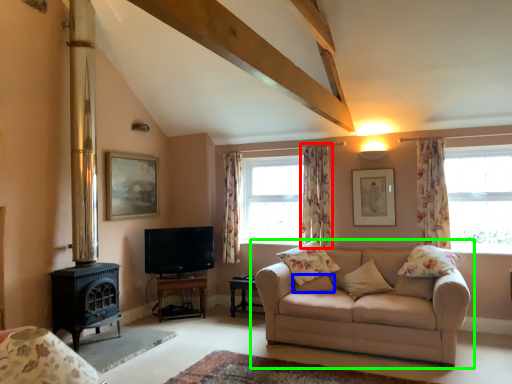
Question: Estimate the real-world distances between objects in this image. Which object is closer to curtain (highlighted by a red box), pillow (highlighted by a blue box) or studio couch (highlighted by a green box)?

Choices:
 (A) pillow
 (B) studio couch

Answer: (A)